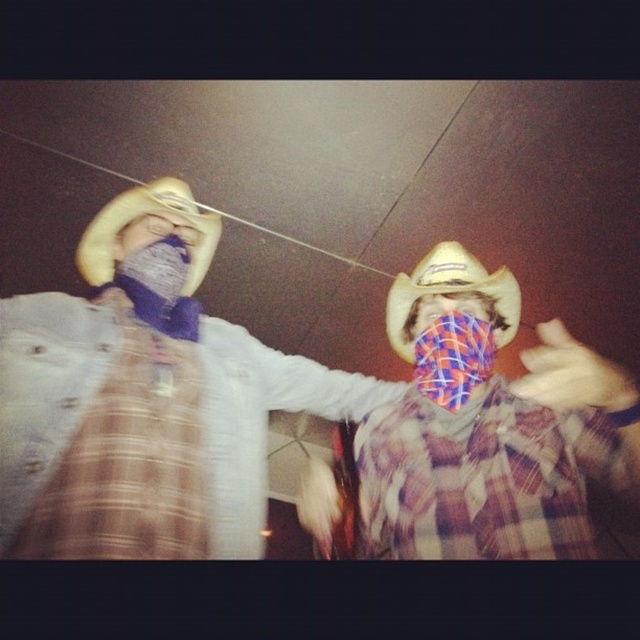
Question: Is the position of light brown leather cowboy hat at left less distant than that of light brown felt cowboy hat at center?

Choices:
 (A) no
 (B) yes

Answer: (B)

Question: Which object appears farthest from the camera in this image?

Choices:
 (A) light brown leather cowboy hat at left
 (B) light brown felt cowboy hat at center

Answer: (B)

Question: In this image, where is light brown leather cowboy hat at left located relative to light brown felt cowboy hat at center?

Choices:
 (A) right
 (B) left

Answer: (B)

Question: Does light brown leather cowboy hat at left appear on the left side of light brown felt cowboy hat at center?

Choices:
 (A) yes
 (B) no

Answer: (A)

Question: Which point is farther to the camera?

Choices:
 (A) light brown leather cowboy hat at left
 (B) light brown felt cowboy hat at center

Answer: (B)